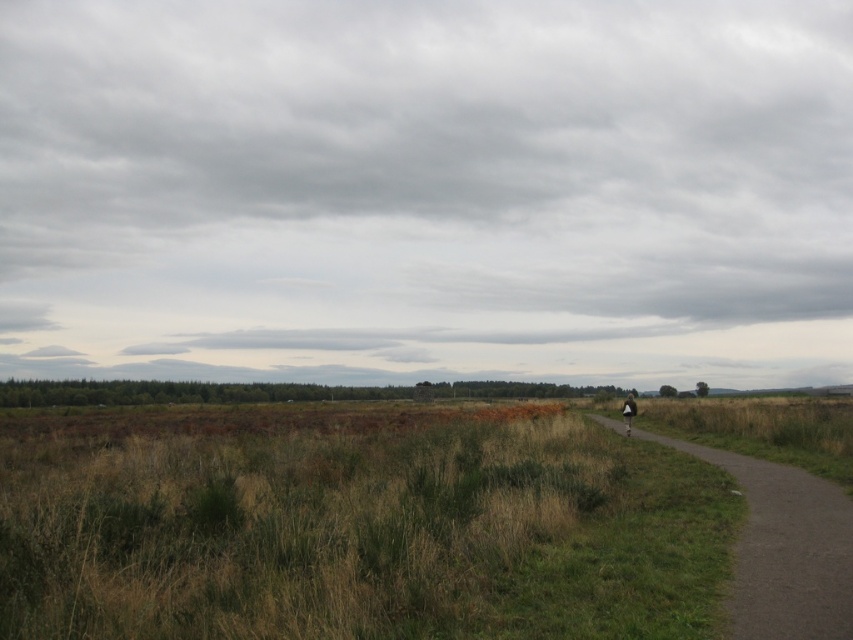
You are standing at the starting point of the dull gray asphalt path at right. If you walk straight ahead, will you eventually reach the horizon shown in the scene?

The dull gray asphalt path at right is positioned at point (784,548), so yes, walking straight ahead along the path will lead you towards the horizon shown in the scene.